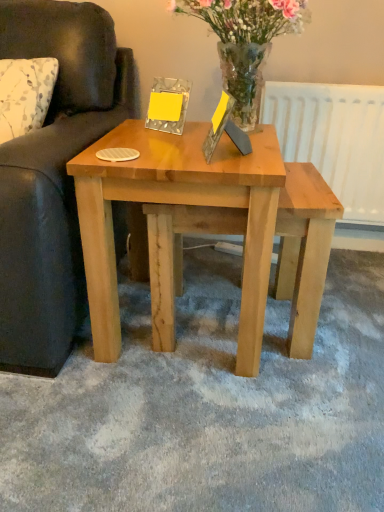
Identify the location of vacant area that is in front of wooden picture frame at center. (230, 170).